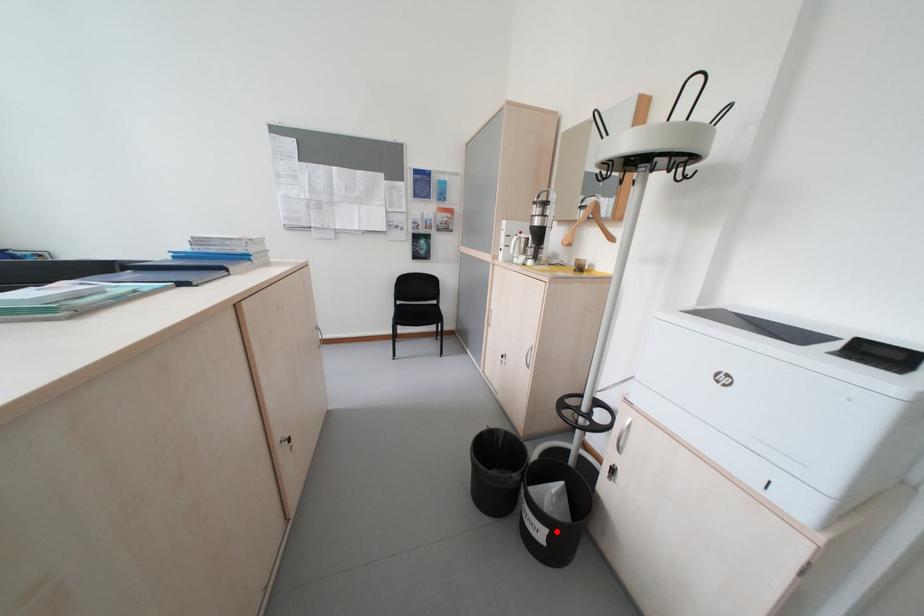
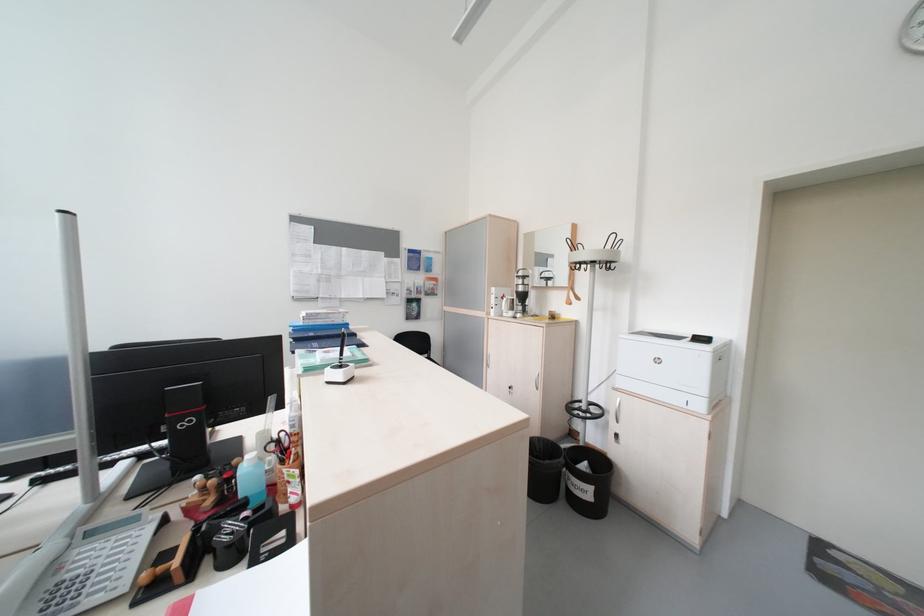
Where in the second image is the point corresponding to the highlighted location from the first image?

(602, 490)